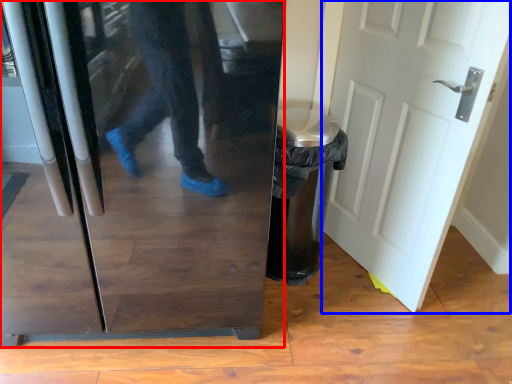
Question: Which point is further to the camera, refrigerator (highlighted by a red box) or door (highlighted by a blue box)?

Choices:
 (A) refrigerator
 (B) door

Answer: (B)